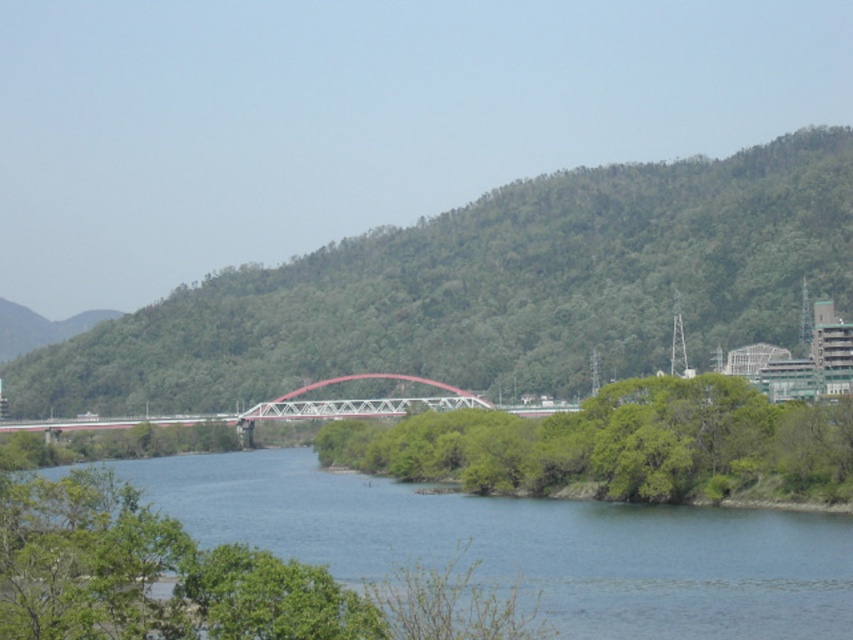
You are standing at the edge of the water and want to walk to the bridge. Which object, the green leafy tree at center or the metallic red bridge at center, would you encounter first?

The green leafy tree at center is closer to the viewer than the metallic red bridge at center, so you would encounter the green leafy tree at center first.

You are a hiker standing at the base of the green leafy hill at center and want to reach the green leafy tree at center. Given that you can walk at a speed of 3.5 km per hour, how long will it take you to reach the tree?

The distance between the green leafy hill at center and the green leafy tree at center is 184.63 meters. Converting that to kilometers gives 0.18463 km. Dividing this by your walking speed of 3.5 km per hour results in approximately 0.05275 hours. Multiplying by 60 minutes gives roughly 3.16 minutes. Therefore, it will take about 3 minutes to reach the tree.

You are standing at the center of the image. Which direction should you move to reach the green leafy hill at center?

The green leafy hill at center is already at the center of the image, so you are already facing it. You don not need to move in any direction to reach it.